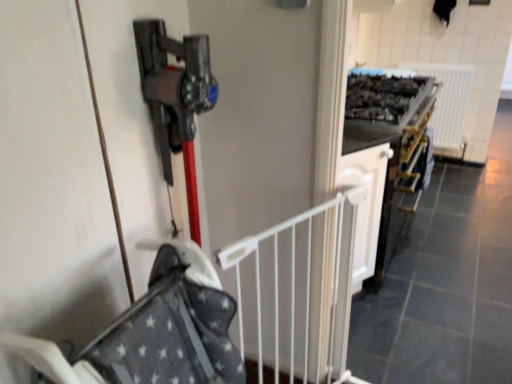
At what (x,y) coordinates should I click in order to perform the action: click on white plastic radiator at upper right. Please return your answer as a coordinate pair (x, y). The width and height of the screenshot is (512, 384). Looking at the image, I should click on pyautogui.click(x=447, y=104).

From the image's perspective, does white glossy cabinet at center appear higher than white plastic radiator at upper right?

Actually, white glossy cabinet at center appears below white plastic radiator at upper right in the image.

Does point (377, 184) appear closer or farther from the camera than point (455, 130)?

Point (377, 184).

Identify the location of radiator that is under the white glossy cabinet at center (from a real-world perspective). (447, 104).

Is white plastic radiator at upper right bigger than white metal gate at center?

Yes.

Can you see white plastic radiator at upper right touching white metal gate at center?

No, white plastic radiator at upper right is not with white metal gate at center.

Is white plastic radiator at upper right to the left or to the right of white metal gate at center in the image?

In the image, white plastic radiator at upper right appears on the right side of white metal gate at center.

Identify the location of radiator behind the gray fabric baby carriage at center. This screenshot has height=384, width=512. click(447, 104).

Between gray fabric baby carriage at center and white plastic radiator at upper right, which one appears on the right side from the viewer's perspective?

Positioned to the right is white plastic radiator at upper right.

From the image's perspective, would you say gray fabric baby carriage at center is positioned over white plastic radiator at upper right?

Incorrect, from the image's perspective, gray fabric baby carriage at center is lower than white plastic radiator at upper right.

Is gray fabric baby carriage at center far away from white plastic radiator at upper right?

Yes.

Locate an element on the screen. radiator below the white metal gate at center (from a real-world perspective) is located at coordinates (447, 104).

From a real-world perspective, which is physically below, white metal gate at center or white plastic radiator at upper right?

From a 3D spatial view, white plastic radiator at upper right is below.

Is point (269, 360) in front of point (464, 84)?

Yes.

From a real-world perspective, is white metal gate at center under white glossy cabinet at center?

Yes, from a real-world perspective, white metal gate at center is beneath white glossy cabinet at center.

Considering the relative sizes of white metal gate at center and white glossy cabinet at center in the image provided, is white metal gate at center taller than white glossy cabinet at center?

Indeed, white metal gate at center has a greater height compared to white glossy cabinet at center.

Considering the relative sizes of white metal gate at center and white glossy cabinet at center in the image provided, is white metal gate at center wider than white glossy cabinet at center?

No, white metal gate at center is not wider than white glossy cabinet at center.

Considering the relative positions of white metal gate at center and white glossy cabinet at center in the image provided, is white metal gate at center in front of white glossy cabinet at center?

Yes, it is in front of white glossy cabinet at center.

Identify the location of baby carriage that appears below the white metal gate at center (from the image's perspective). (151, 337).

Is gray fabric baby carriage at center positioned with its back to white metal gate at center?

gray fabric baby carriage at center does not have its back to white metal gate at center.

Considering the relative positions of gray fabric baby carriage at center and white metal gate at center in the image provided, is gray fabric baby carriage at center to the left of white metal gate at center from the viewer's perspective?

Yes.

Does point (179, 262) come farther from viewer compared to point (304, 238)?

No.

Which of these two, white glossy cabinet at center or gray fabric baby carriage at center, is wider?

gray fabric baby carriage at center.

Is white glossy cabinet at center facing away from gray fabric baby carriage at center?

No, white glossy cabinet at center is not facing away from gray fabric baby carriage at center.

Measure the distance from white glossy cabinet at center to gray fabric baby carriage at center.

95.52 centimeters.

From the picture: Considering the sizes of objects white glossy cabinet at center and gray fabric baby carriage at center in the image provided, who is shorter, white glossy cabinet at center or gray fabric baby carriage at center?

With less height is gray fabric baby carriage at center.

I want to click on radiator that appears below the white glossy cabinet at center (from a real-world perspective), so click(447, 104).

Locate an element on the screen. The height and width of the screenshot is (384, 512). radiator lying above the white metal gate at center (from the image's perspective) is located at coordinates (447, 104).

Based on their spatial positions, is white glossy cabinet at center or white metal gate at center further from gray fabric baby carriage at center?

white glossy cabinet at center.

Considering their positions, is gray fabric baby carriage at center positioned further to white plastic radiator at upper right than white metal gate at center?

Based on the image, gray fabric baby carriage at center appears to be further to white plastic radiator at upper right.

When comparing their distances from white metal gate at center, does gray fabric baby carriage at center or white glossy cabinet at center seem further?

Among the two, white glossy cabinet at center is located further to white metal gate at center.

Which object lies nearer to the anchor point gray fabric baby carriage at center, white glossy cabinet at center or white plastic radiator at upper right?

white glossy cabinet at center is closer to gray fabric baby carriage at center.

Considering their positions, is white metal gate at center positioned closer to white plastic radiator at upper right than white glossy cabinet at center?

The object closer to white plastic radiator at upper right is white glossy cabinet at center.

Based on their spatial positions, is white plastic radiator at upper right or white metal gate at center closer to gray fabric baby carriage at center?

white metal gate at center.

When comparing their distances from white metal gate at center, does white plastic radiator at upper right or gray fabric baby carriage at center seem closer?

gray fabric baby carriage at center lies closer to white metal gate at center than the other object.

Estimate the real-world distances between objects in this image. Which object is further from gray fabric baby carriage at center, white metal gate at center or white glossy cabinet at center?

Among the two, white glossy cabinet at center is located further to gray fabric baby carriage at center.

This screenshot has height=384, width=512. What are the coordinates of `cabinetry between gray fabric baby carriage at center and white plastic radiator at upper right along the z-axis` in the screenshot? It's located at (366, 205).

The height and width of the screenshot is (384, 512). I want to click on rail between gray fabric baby carriage at center and white glossy cabinet at center in the front-back direction, so click(300, 289).

Identify the location of rail located between gray fabric baby carriage at center and white plastic radiator at upper right in the depth direction. This screenshot has width=512, height=384. (300, 289).

Identify the location of cabinetry between white metal gate at center and white plastic radiator at upper right in the front-back direction. The height and width of the screenshot is (384, 512). 366,205.